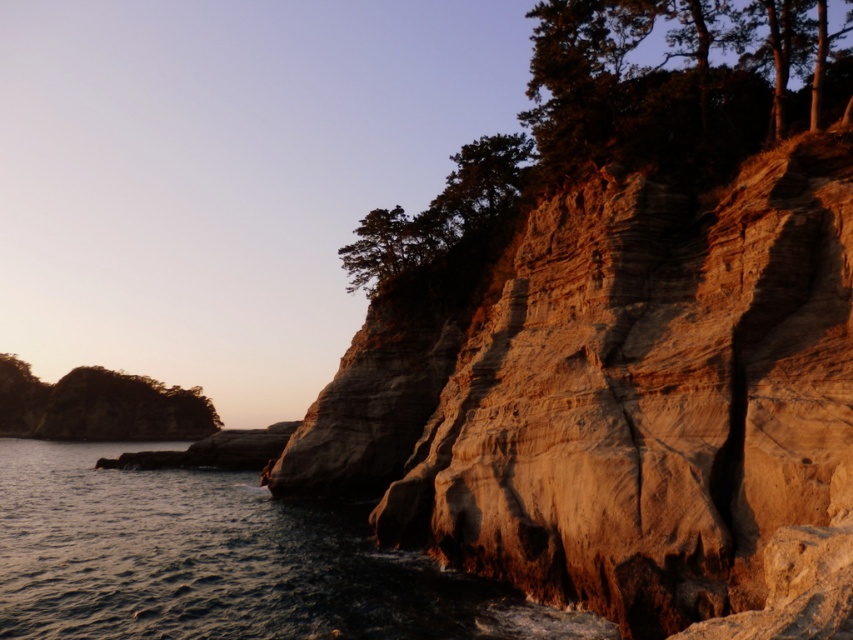
Which is more to the left, dark blue water at lower left or green leafy tree at left?

Positioned to the left is green leafy tree at left.

Which is in front, point (328, 632) or point (74, 438)?

Positioned in front is point (328, 632).

Is point (119, 584) positioned in front of point (160, 403)?

Yes.

This screenshot has height=640, width=853. I want to click on dark blue water at lower left, so click(x=221, y=561).

Is point (393, 275) positioned in front of point (117, 404)?

Yes, point (393, 275) is in front of point (117, 404).

Between dark green textured tree at upper right and green leafy tree at left, which one is positioned higher?

dark green textured tree at upper right

Is point (708, 180) more distant than point (73, 433)?

No, (708, 180) is in front of (73, 433).

Identify the location of dark green textured tree at upper right. The width and height of the screenshot is (853, 640). (624, 113).

Who is positioned more to the right, rustic stone cliff at right or green leafy tree at left?

rustic stone cliff at right

What do you see at coordinates (624, 404) in the screenshot? I see `rustic stone cliff at right` at bounding box center [624, 404].

You are a GUI agent. You are given a task and a screenshot of the screen. Output one action in this format:
    pyautogui.click(x=<x>, y=<y>)
    Task: Click on the rustic stone cliff at right
    The image size is (853, 640).
    Given the screenshot: What is the action you would take?
    pyautogui.click(x=624, y=404)